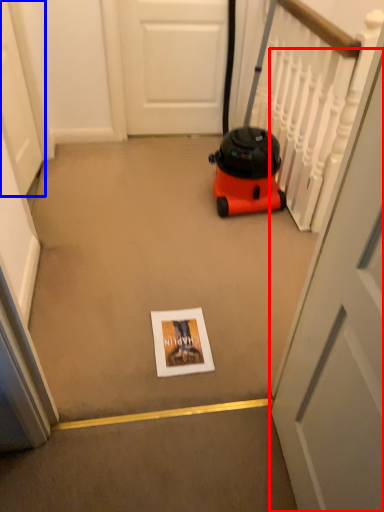
Question: Among these objects, which one is farthest to the camera, door (highlighted by a red box) or door (highlighted by a blue box)?

Choices:
 (A) door
 (B) door

Answer: (B)